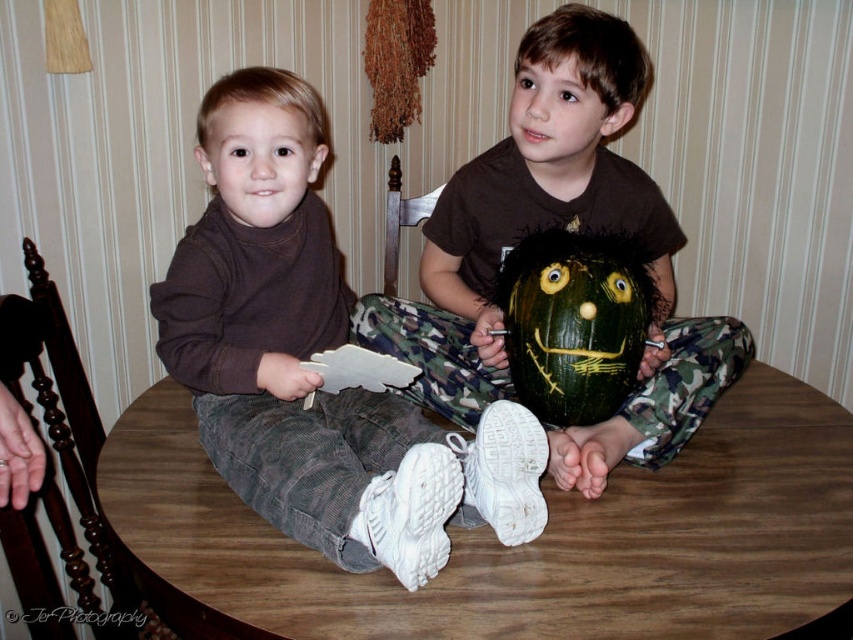
Question: Can you confirm if green matte pumpkin at center is wider than matte brown turtleneck at center?

Choices:
 (A) no
 (B) yes

Answer: (B)

Question: In this image, where is wooden table at center located relative to smooth brown face at upper center?

Choices:
 (A) right
 (B) left

Answer: (B)

Question: Based on their relative distances, which object is nearer to the brown cotton sweater at left?

Choices:
 (A) matte brown turtleneck at center
 (B) wooden table at center
 (C) green matte pumpkin at center

Answer: (A)

Question: Estimate the real-world distances between objects in this image. Which object is closer to the green matte pumpkin at center?

Choices:
 (A) brown cotton sweater at left
 (B) wooden table at center
 (C) smooth brown face at upper center

Answer: (C)

Question: Which of the following is the closest to the observer?

Choices:
 (A) smooth brown face at upper center
 (B) brown cotton sweater at left
 (C) wooden table at center

Answer: (C)

Question: Can you confirm if green matte pumpkin at center is smaller than matte brown turtleneck at center?

Choices:
 (A) no
 (B) yes

Answer: (A)